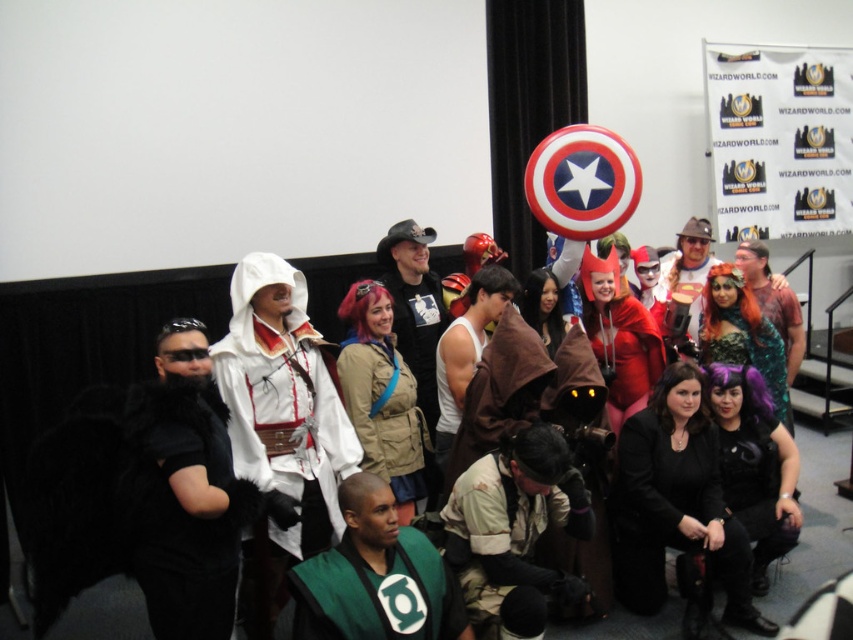
You are a photographer at the event and need to capture a clear photo of both the camouflage fabric pants at center and the shiny metallic armor at center. Which object should you focus on first to ensure both are in focus?

You should focus on the camouflage fabric pants at center first since it is in front of the shiny metallic armor at center, allowing both to be in focus when using a shallow depth of field.